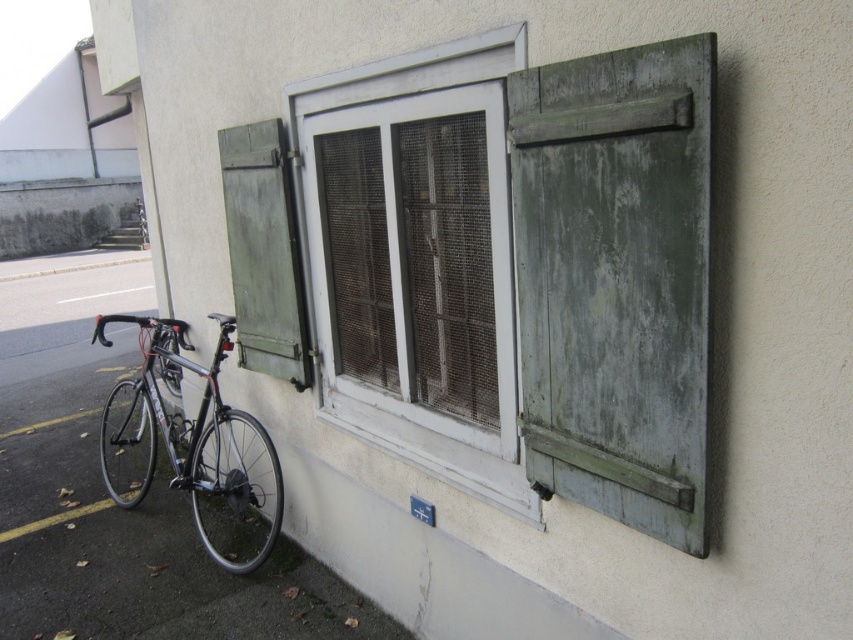
You are standing in front of the building and want to place a small potted plant between the two points marked as point (440,467) and point (247,164). Based on their positions, which point should the plant be closer to?

The plant should be placed closer to point (247,164) because point (440,467) is in front of point (247,164), meaning the latter is further back.

You are standing in front of a building and notice a green painted wood window at center. If you were to draw a straight line from your eye level to the window, would it intersect the window at its top, middle, or bottom section?

The green painted wood window at center is located at point coordinates that are not provided in the scene description, so we cannot determine where a straight line from your eye level would intersect the window. The scene description only provides the window position as being at the center of the image.

In the scene shown: You are a painter standing at the base of the building looking up at the green weathered wood shutter at right and the green weathered wood shutter at left. Which shutter is positioned to the east if the building faces south?

The green weathered wood shutter at right is positioned to the east because when facing south, east would be to the right side.